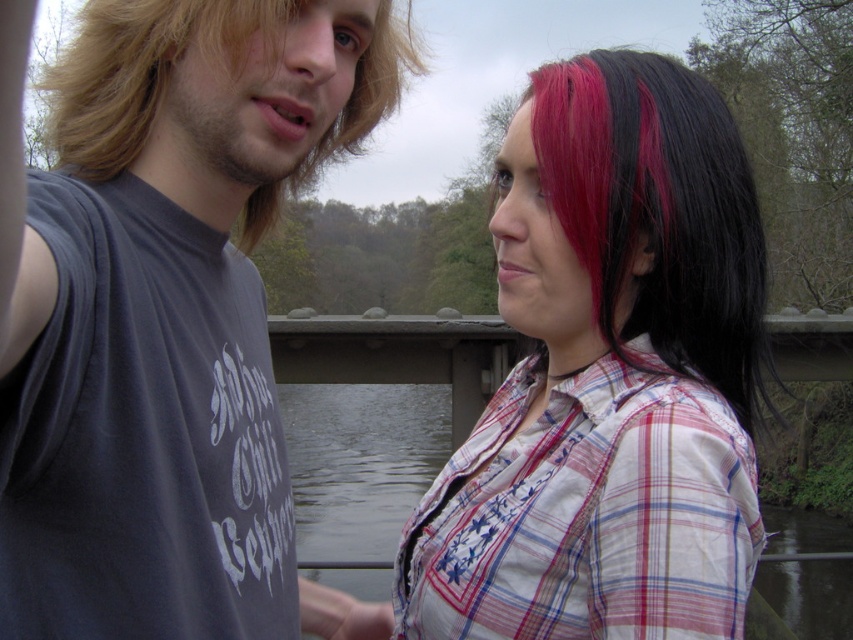
Looking at this image, is plaid cotton shirt at right in front of black shiny hair at upper right?

Yes, it is.

Which is in front, point (502, 588) or point (705, 220)?

Point (502, 588) is more forward.

Locate an element on the screen. plaid cotton shirt at right is located at coordinates (587, 515).

Is point (285, 518) in front of point (619, 289)?

No.

Can you confirm if dark gray sleeveless shirt at left is positioned to the right of black shiny hair at upper right?

No, dark gray sleeveless shirt at left is not to the right of black shiny hair at upper right.

Find the location of `dark gray sleeveless shirt at left`. dark gray sleeveless shirt at left is located at coordinates (164, 307).

Who is more forward, (685,547) or (161,90)?

Positioned in front is point (685,547).

Between plaid cotton shirt at right and blonde hair at left, which one appears on the right side from the viewer's perspective?

Positioned to the right is plaid cotton shirt at right.

Describe the element at coordinates (587, 515) in the screenshot. Image resolution: width=853 pixels, height=640 pixels. I see `plaid cotton shirt at right` at that location.

Identify the location of plaid cotton shirt at right. (587, 515).